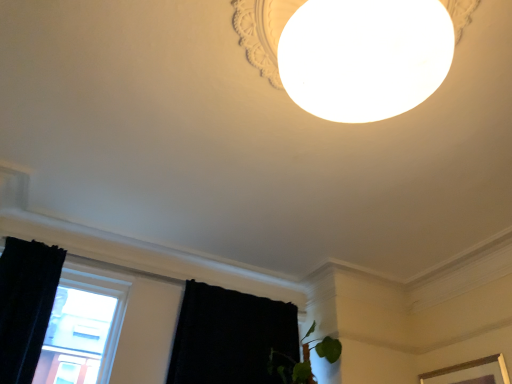
Question: Can you confirm if black fabric curtain at lower left, the second curtain positioned from the left, is thinner than black velvet curtain at left, the first curtain from the left?

Choices:
 (A) no
 (B) yes

Answer: (B)

Question: Is black velvet curtain at left, the first curtain from the left, inside black fabric curtain at lower left, the 1th curtain when ordered from right to left?

Choices:
 (A) yes
 (B) no

Answer: (B)

Question: Is black fabric curtain at lower left, the 1th curtain when ordered from right to left, looking in the opposite direction of black velvet curtain at left, which ranks as the second curtain in right-to-left order?

Choices:
 (A) yes
 (B) no

Answer: (B)

Question: Can you confirm if black fabric curtain at lower left, the second curtain positioned from the left, is shorter than black velvet curtain at left, which ranks as the second curtain in right-to-left order?

Choices:
 (A) no
 (B) yes

Answer: (B)

Question: Is black fabric curtain at lower left, the 1th curtain when ordered from right to left, outside black velvet curtain at left, which ranks as the second curtain in right-to-left order?

Choices:
 (A) yes
 (B) no

Answer: (A)

Question: Is black fabric curtain at lower left, the second curtain positioned from the left, spatially inside transparent glass window at lower left, or outside of it?

Choices:
 (A) outside
 (B) inside

Answer: (A)

Question: In terms of size, does black fabric curtain at lower left, the 1th curtain when ordered from right to left, appear bigger or smaller than transparent glass window at lower left?

Choices:
 (A) small
 (B) big

Answer: (B)

Question: Is black fabric curtain at lower left, the 1th curtain when ordered from right to left, taller or shorter than transparent glass window at lower left?

Choices:
 (A) short
 (B) tall

Answer: (A)

Question: In the image, is black fabric curtain at lower left, the 1th curtain when ordered from right to left, positioned in front of or behind transparent glass window at lower left?

Choices:
 (A) front
 (B) behind

Answer: (B)

Question: Is transparent glass window at lower left inside or outside of black velvet curtain at left, the first curtain from the left?

Choices:
 (A) outside
 (B) inside

Answer: (A)

Question: Is transparent glass window at lower left wider or thinner than black velvet curtain at left, the first curtain from the left?

Choices:
 (A) thin
 (B) wide

Answer: (A)

Question: From their relative heights in the image, would you say transparent glass window at lower left is taller or shorter than black velvet curtain at left, the first curtain from the left?

Choices:
 (A) tall
 (B) short

Answer: (B)

Question: From the image's perspective, is transparent glass window at lower left positioned above or below black velvet curtain at left, which ranks as the second curtain in right-to-left order?

Choices:
 (A) above
 (B) below

Answer: (B)

Question: Does point (65, 278) appear closer or farther from the camera than point (204, 339)?

Choices:
 (A) closer
 (B) farther

Answer: (A)

Question: From the image's perspective, relative to black fabric curtain at lower left, the second curtain positioned from the left, is transparent glass window at lower left above or below?

Choices:
 (A) above
 (B) below

Answer: (A)